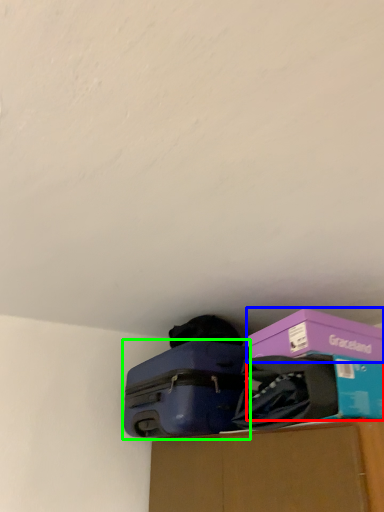
Question: Estimate the real-world distances between objects in this image. Which object is closer to storage box (highlighted by a red box), box (highlighted by a blue box) or suitcase (highlighted by a green box)?

Choices:
 (A) box
 (B) suitcase

Answer: (A)